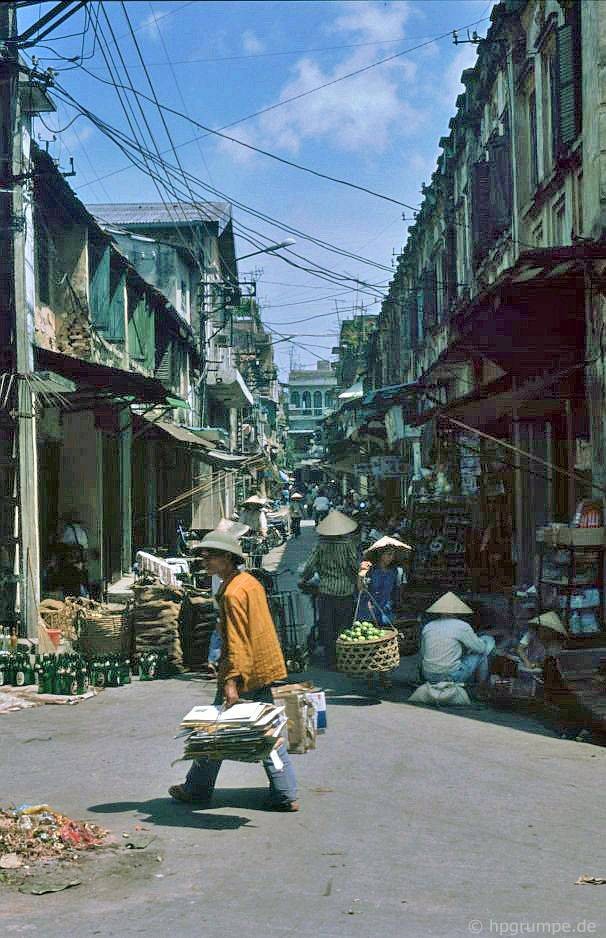
The image size is (606, 938). What are the coordinates of `bottles` in the screenshot? It's located at (145, 666), (105, 669), (68, 676), (17, 669).